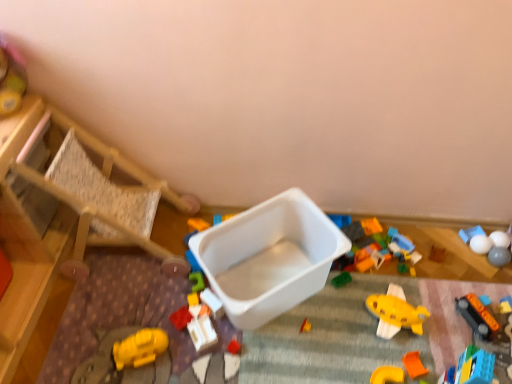
What are the coordinates of `vacant space to the left of orange matte block at lower right, placed as the seventh toy when sorted from right to left` in the screenshot? It's located at (359, 356).